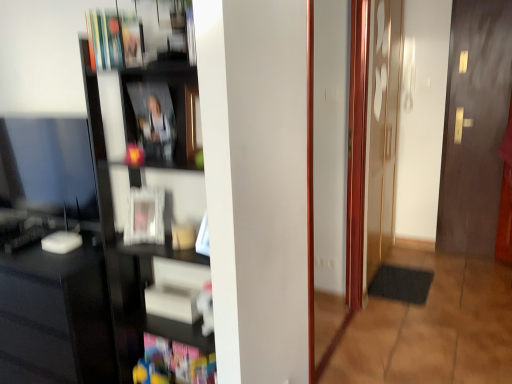
This screenshot has width=512, height=384. Find the location of `multicolored cardboard book at lower center, acting as the first book starting from the bottom`. multicolored cardboard book at lower center, acting as the first book starting from the bottom is located at coordinates (174, 362).

Measure the distance between point (x=179, y=344) and camera.

Point (x=179, y=344) and camera are 6.09 feet apart.

Find the location of a particular element. The height and width of the screenshot is (384, 512). black glossy computer desk at left is located at coordinates (56, 317).

This screenshot has width=512, height=384. In order to click on hardcover book at upper center, which ranks as the 5th book in bottom-to-top order in this screenshot , I will do `click(131, 39)`.

Image resolution: width=512 pixels, height=384 pixels. In order to click on multicolored cardboard book at lower center, arranged as the seventh book when viewed from the top in this screenshot , I will do `click(174, 362)`.

In the image, is clear glass door at center on the left side or the right side of hardcover book at upper center, which ranks as the 5th book in bottom-to-top order?

In the image, clear glass door at center appears on the right side of hardcover book at upper center, which ranks as the 5th book in bottom-to-top order.

Is clear glass door at center beside hardcover book at upper center, which is the third book in top-to-bottom order?

clear glass door at center and hardcover book at upper center, which is the third book in top-to-bottom order, are not in contact.

How different are the orientations of clear glass door at center and hardcover book at upper center, which is the third book in top-to-bottom order, in degrees?

The facing directions of clear glass door at center and hardcover book at upper center, which is the third book in top-to-bottom order, are 91.1 degrees apart.

From a real-world perspective, is clear glass door at center under hardcover book at upper center, which ranks as the 5th book in bottom-to-top order?

Correct, in the physical world, clear glass door at center is lower than hardcover book at upper center, which ranks as the 5th book in bottom-to-top order.

Is black glossy shelf at left far away from black rubber mat at lower right?

black glossy shelf at left is far away from black rubber mat at lower right.

Considering their positions, is black glossy shelf at left located in front of or behind black rubber mat at lower right?

black glossy shelf at left is in front of black rubber mat at lower right.

Does point (128, 301) come closer to viewer compared to point (409, 271)?

Yes, point (128, 301) is in front of point (409, 271).

From a real-world perspective, is white matte book at center, acting as the 2th book starting from the bottom, beneath black glossy shelf at left?

Yes.

From the picture: Could black glossy shelf at left be considered to be inside white matte book at center, which appears as the 6th book when viewed from the top?

No.

Is white matte book at center, acting as the 2th book starting from the bottom, smaller than black glossy shelf at left?

Correct, white matte book at center, acting as the 2th book starting from the bottom, occupies less space than black glossy shelf at left.

Relative to matte white photo frame at center, which ranks as the third book in bottom-to-top order, is hardcover book at upper left, the sixth book when ordered from bottom to top, in front or behind?

Clearly, hardcover book at upper left, the sixth book when ordered from bottom to top, is in front of matte white photo frame at center, which ranks as the third book in bottom-to-top order.

How far apart are hardcover book at upper left, the sixth book when ordered from bottom to top, and matte white photo frame at center, which ranks as the third book in bottom-to-top order?

24.18 inches.

Considering the positions of objects hardcover book at upper left, the sixth book when ordered from bottom to top, and matte white photo frame at center, positioned as the 5th book in top-to-bottom order, in the image provided, who is more to the right, hardcover book at upper left, the sixth book when ordered from bottom to top, or matte white photo frame at center, positioned as the 5th book in top-to-bottom order,?

From the viewer's perspective, matte white photo frame at center, positioned as the 5th book in top-to-bottom order, appears more on the right side.

From the image's perspective, between hardcover book at upper left, positioned as the second book in top-to-bottom order, and matte white photo frame at center, positioned as the 5th book in top-to-bottom order, which one is located above?

hardcover book at upper left, positioned as the second book in top-to-bottom order.

From a real-world perspective, relative to black glossy shelf at left, is clear glass door at center vertically above or below?

clear glass door at center is situated higher than black glossy shelf at left in the real world.

Is clear glass door at center closer to camera compared to black glossy shelf at left?

No, it is not.

In the scene shown: Can black glossy shelf at left be found inside clear glass door at center?

No.

Is clear glass door at center turned away from black glossy shelf at left?

No, clear glass door at center is not facing away from black glossy shelf at left.

Consider the image. Is multicolored cardboard book at lower center, arranged as the seventh book when viewed from the top, next to matte white photo frame at center, which ranks as the third book in bottom-to-top order, and touching it?

multicolored cardboard book at lower center, arranged as the seventh book when viewed from the top, is not next to matte white photo frame at center, which ranks as the third book in bottom-to-top order, and they're not touching.

From a real-world perspective, is multicolored cardboard book at lower center, acting as the first book starting from the bottom, under matte white photo frame at center, which ranks as the third book in bottom-to-top order?

Yes, from a real-world perspective, multicolored cardboard book at lower center, acting as the first book starting from the bottom, is below matte white photo frame at center, which ranks as the third book in bottom-to-top order.

Would you say multicolored cardboard book at lower center, arranged as the seventh book when viewed from the top, contains matte white photo frame at center, which ranks as the third book in bottom-to-top order?

That's incorrect, matte white photo frame at center, which ranks as the third book in bottom-to-top order, is not inside multicolored cardboard book at lower center, arranged as the seventh book when viewed from the top.

Considering the points (192, 377) and (132, 233), which point is behind, point (192, 377) or point (132, 233)?

Positioned behind is point (132, 233).

From the picture: Is hardcover book at upper center, which ranks as the 5th book in bottom-to-top order, taller than black glossy shelf at left?

In fact, hardcover book at upper center, which ranks as the 5th book in bottom-to-top order, may be shorter than black glossy shelf at left.

Is point (133, 27) positioned before point (176, 149)?

Yes, it is.

Considering the positions of objects hardcover book at upper center, which ranks as the 5th book in bottom-to-top order, and black glossy shelf at left in the image provided, who is more to the right, hardcover book at upper center, which ranks as the 5th book in bottom-to-top order, or black glossy shelf at left?

black glossy shelf at left is more to the right.

From a real-world perspective, is hardcover book at upper center, which ranks as the 5th book in bottom-to-top order, under black glossy shelf at left?

No, from a real-world perspective, hardcover book at upper center, which ranks as the 5th book in bottom-to-top order, is not below black glossy shelf at left.

Where is `screen door directly beneath the hardcover book at upper center, which is the third book in top-to-bottom order (from a real-world perspective)`? Image resolution: width=512 pixels, height=384 pixels. screen door directly beneath the hardcover book at upper center, which is the third book in top-to-bottom order (from a real-world perspective) is located at coordinates (382, 131).

Locate an element on the screen. This screenshot has width=512, height=384. shelf on the left of the black rubber mat at lower right is located at coordinates click(128, 198).

Looking at the image, which one is located closer to black glossy computer desk at left, white matte book at center, which appears as the 6th book when viewed from the top, or matte white photo frame at center, positioned as the 5th book in top-to-bottom order?

Based on the image, white matte book at center, which appears as the 6th book when viewed from the top, appears to be nearer to black glossy computer desk at left.

Considering their positions, is clear glass door at center positioned further to black rubber mat at lower right than hardcover book at upper left, the sixth book when ordered from bottom to top?

Among the two, hardcover book at upper left, the sixth book when ordered from bottom to top, is located further to black rubber mat at lower right.

Considering their positions, is clear glass door at center positioned closer to multicolored cardboard book at lower center, arranged as the seventh book when viewed from the top, than matte black book at center, which appears as the 4th book when ordered from the bottom?

matte black book at center, which appears as the 4th book when ordered from the bottom, is closer to multicolored cardboard book at lower center, arranged as the seventh book when viewed from the top.

Estimate the real-world distances between objects in this image. Which object is closer to black glossy shelf at left, multicolored cardboard book at lower center, arranged as the seventh book when viewed from the top, or black glossy computer desk at left?

black glossy computer desk at left is positioned closer to the anchor black glossy shelf at left.

Which object lies further to the anchor point dark wood door at right, matte white photo frame at center, which ranks as the third book in bottom-to-top order, or matte black book at center, which is the fourth book in top-to-bottom order?

Based on the image, matte white photo frame at center, which ranks as the third book in bottom-to-top order, appears to be further to dark wood door at right.

Considering their positions, is matte white photo frame at center, which ranks as the third book in bottom-to-top order, positioned further to clear glass door at center than black glossy shelf at left?

matte white photo frame at center, which ranks as the third book in bottom-to-top order, is further to clear glass door at center.

Estimate the real-world distances between objects in this image. Which object is closer to black rubber mat at lower right, white matte book at center, acting as the 2th book starting from the bottom, or dark wood door at right?

The object closer to black rubber mat at lower right is dark wood door at right.

Which object lies further to the anchor point black glossy shelf at left, matte black book at center, which appears as the 4th book when ordered from the bottom, or hardcover book at upper center, which is the third book in top-to-bottom order?

hardcover book at upper center, which is the third book in top-to-bottom order.

Locate an element on the screen. Image resolution: width=512 pixels, height=384 pixels. screen door between black glossy computer desk at left and dark wood door at right in the horizontal direction is located at coordinates tap(382, 131).

The height and width of the screenshot is (384, 512). What are the coordinates of `shelf between matte white photo frame at center, positioned as the 5th book in top-to-bottom order, and clear glass door at center, in the horizontal direction` in the screenshot? It's located at (128, 198).

You are a GUI agent. You are given a task and a screenshot of the screen. Output one action in this format:
    pyautogui.click(x=<x>, y=<y>)
    Task: Click on the flat between matte white photo frame at center, positioned as the 5th book in top-to-bottom order, and dark wood door at right from left to right
    The image size is (512, 384).
    Given the screenshot: What is the action you would take?
    pyautogui.click(x=401, y=284)

Where is `shelf between hardcover book at upper center, which is the third book in top-to-bottom order, and multicolored cardboard book at lower center, acting as the first book starting from the bottom, vertically`? This screenshot has width=512, height=384. shelf between hardcover book at upper center, which is the third book in top-to-bottom order, and multicolored cardboard book at lower center, acting as the first book starting from the bottom, vertically is located at coordinates (128, 198).